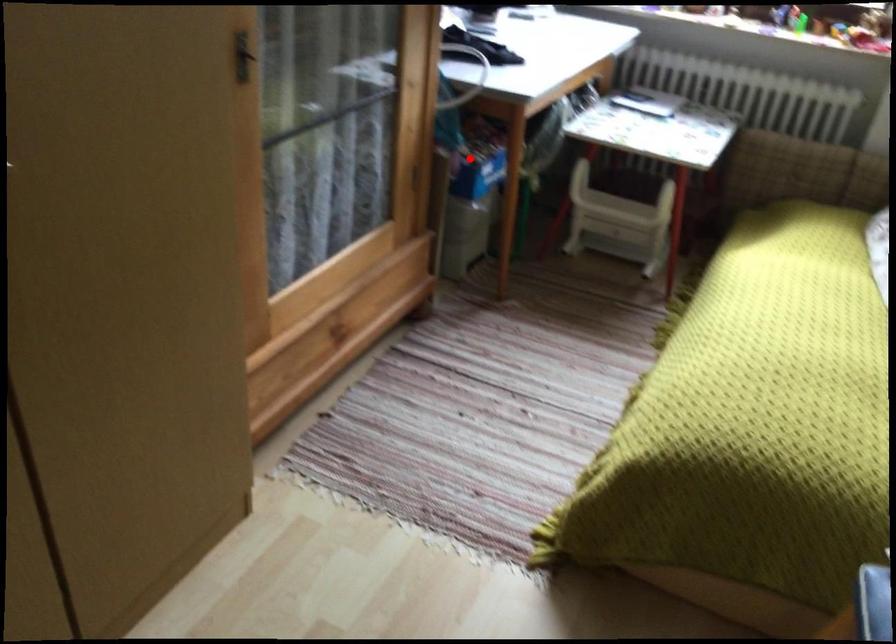
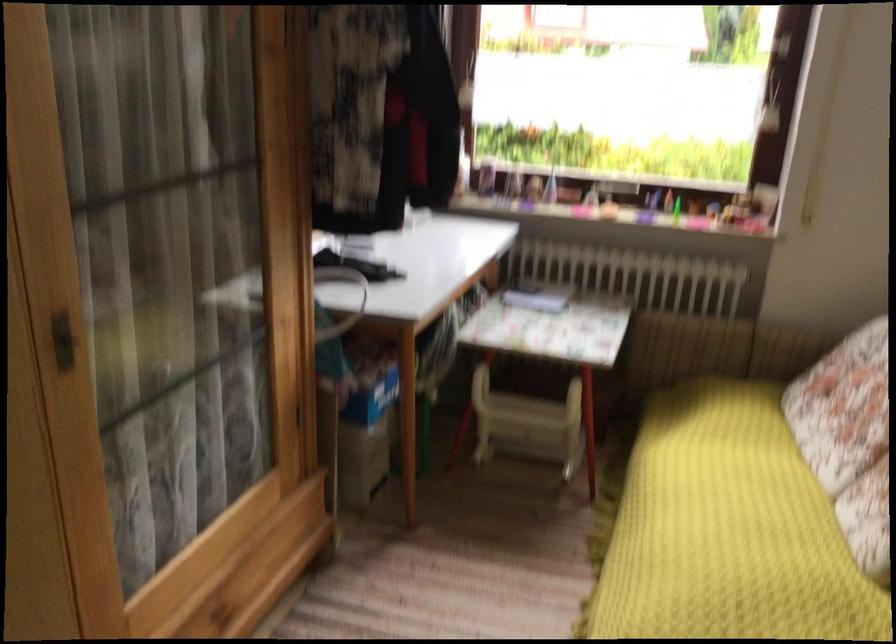
Find the pixel in the second image that matches the highlighted location in the first image.

(360, 381)